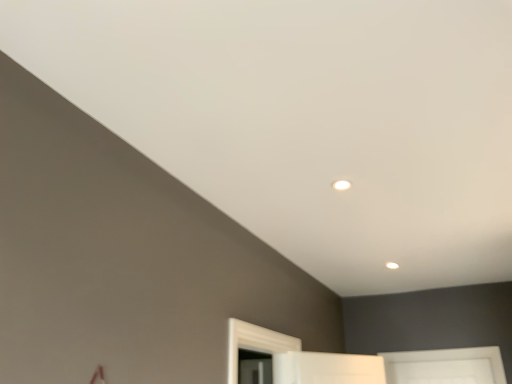
What do you see at coordinates (341, 185) in the screenshot? I see `white glossy light at upper center` at bounding box center [341, 185].

At what (x,y) coordinates should I click in order to perform the action: click on white glossy light at upper center. Please return your answer as a coordinate pair (x, y). Image resolution: width=512 pixels, height=384 pixels. Looking at the image, I should click on (341, 185).

Identify the location of white glossy light at upper center. (341, 185).